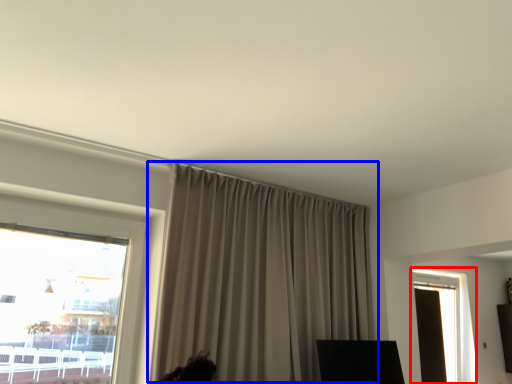
Question: Among these objects, which one is nearest to the camera, window (highlighted by a red box) or curtain (highlighted by a blue box)?

Choices:
 (A) window
 (B) curtain

Answer: (B)